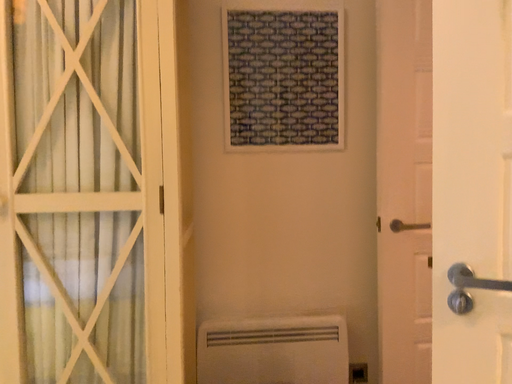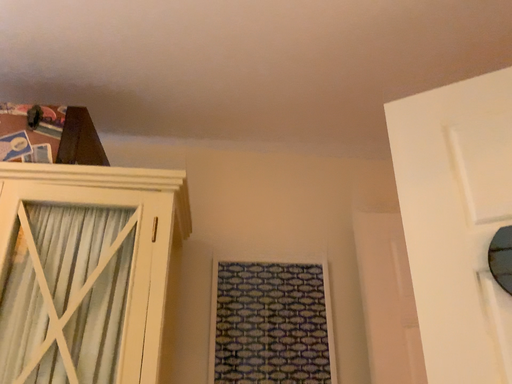
Question: How did the camera likely rotate when shooting the video?

Choices:
 (A) rotated upward
 (B) rotated downward

Answer: (A)